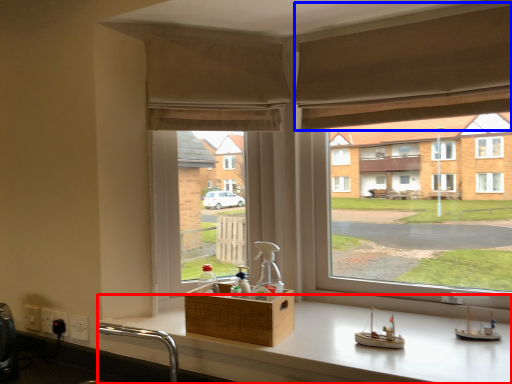
Question: Which point is further to the camera, counter (highlighted by a red box) or curtain (highlighted by a blue box)?

Choices:
 (A) counter
 (B) curtain

Answer: (B)